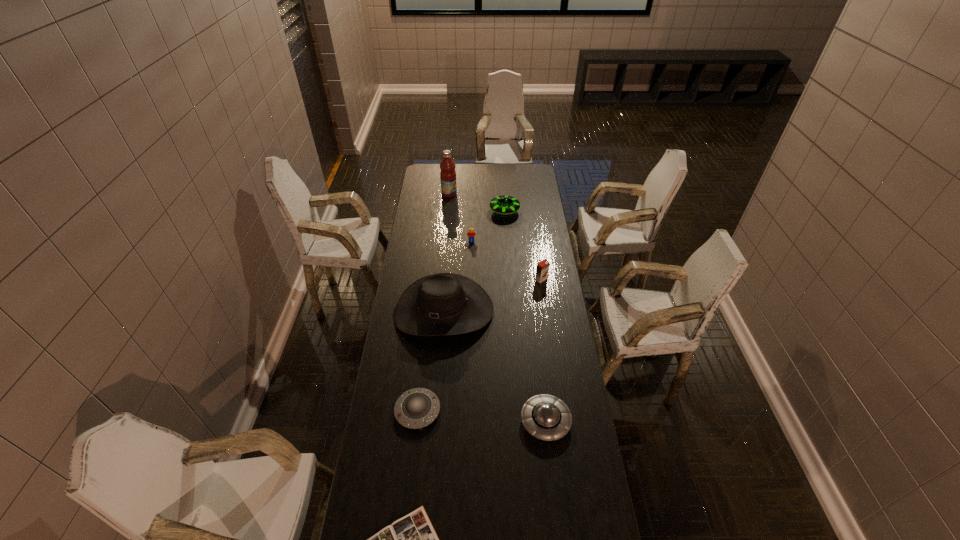
This screenshot has width=960, height=540. In the image, there is a desktop. In order to click on vacant space at the right edge in this screenshot , I will do `click(528, 289)`.

In order to click on unoccupied area between the orange juice and the tallest object in this screenshot , I will do `click(495, 237)`.

The image size is (960, 540). Identify the location of the fourth closest object to the fruit juice. tap(542, 269).

Identify which object is the sixth nearest to the cowboy hat. Please provide its 2D coordinates. Your answer should be formatted as a tuple, i.e. [(x, y)], where the tuple contains the x and y coordinates of a point satisfying the conditions above.

[(411, 539)]

The height and width of the screenshot is (540, 960). Find the location of `saucer identified as the closest to the seventh shortest object`. saucer identified as the closest to the seventh shortest object is located at coordinates (416, 408).

Locate an element on the screen. the second closest saucer relative to the farthest object is located at coordinates (416, 408).

You are a GUI agent. You are given a task and a screenshot of the screen. Output one action in this format:
    pyautogui.click(x=<x>, y=<y>)
    Task: Click on the free space that satisfies the following two spatial constraints: 1. on the front label of the second farthest object; 2. on the left side of the farthest object
    
    Given the screenshot: What is the action you would take?
    pyautogui.click(x=447, y=211)

Find the location of `blank space that satisfies the following two spatial constraints: 1. on the front side of the orange juice; 2. on the right side of the second farthest object`. blank space that satisfies the following two spatial constraints: 1. on the front side of the orange juice; 2. on the right side of the second farthest object is located at coordinates (510, 279).

Where is `free space that satisfies the following two spatial constraints: 1. on the front label of the farthest object; 2. on the left side of the farthest saucer`? The height and width of the screenshot is (540, 960). free space that satisfies the following two spatial constraints: 1. on the front label of the farthest object; 2. on the left side of the farthest saucer is located at coordinates (447, 211).

The width and height of the screenshot is (960, 540). Identify the location of vacant region that satisfies the following two spatial constraints: 1. on the front label of the sixth shortest object; 2. on the left side of the fruit juice. (442, 279).